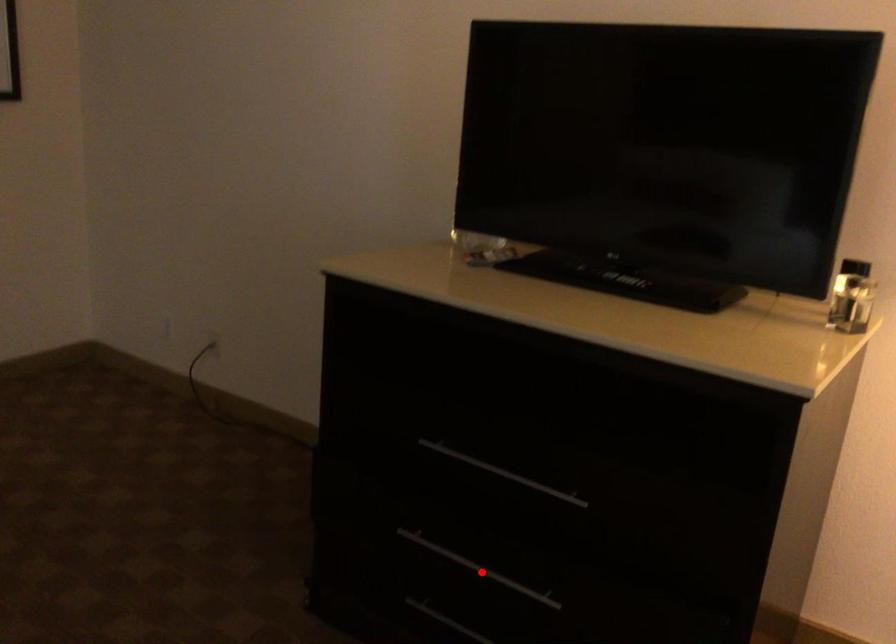
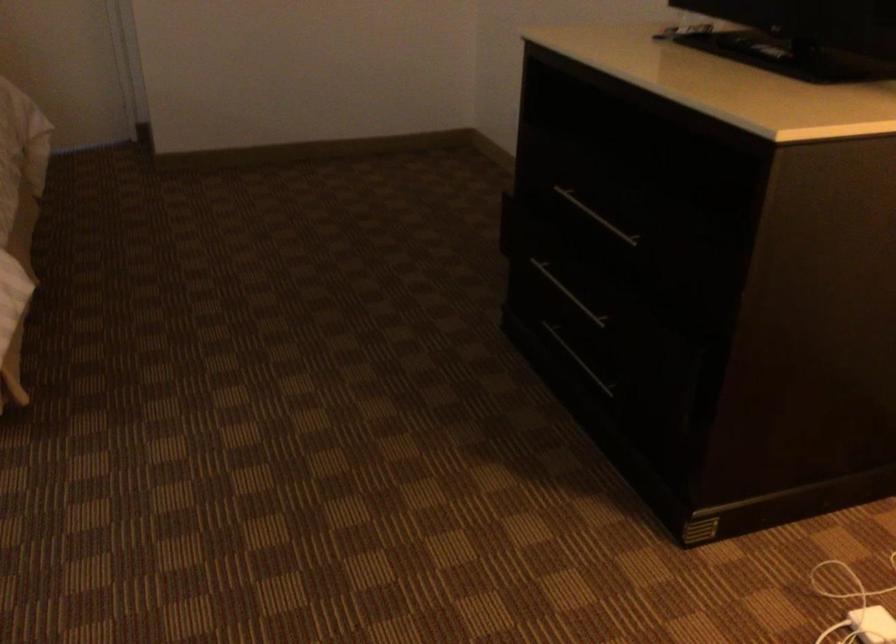
Find the pixel in the second image that matches the highlighted location in the first image.

(567, 292)